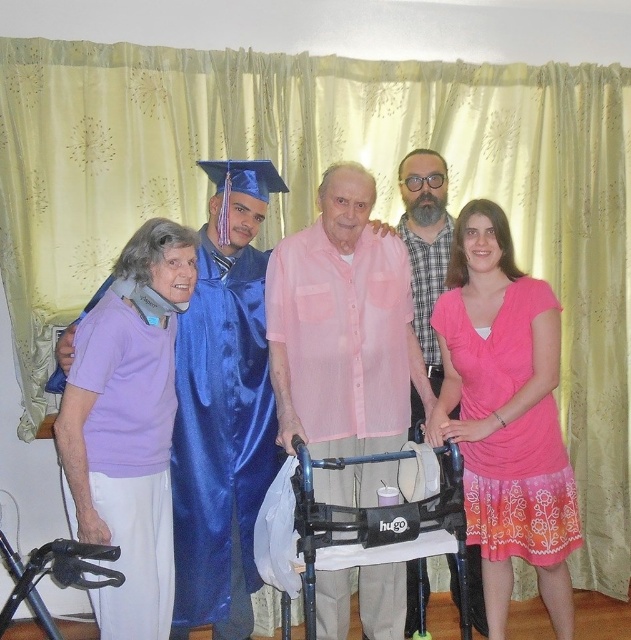
In the scene shown: Can you confirm if pink fabric dress at center is positioned below blue satin graduation gown at center?

Correct, pink fabric dress at center is located below blue satin graduation gown at center.

Can you confirm if pink fabric dress at center is bigger than blue satin graduation gown at center?

Indeed, pink fabric dress at center has a larger size compared to blue satin graduation gown at center.

I want to click on pink fabric dress at center, so 505,413.

Is pink sheer shirt at center smaller than pink satin walker at center?

Correct, pink sheer shirt at center occupies less space than pink satin walker at center.

Identify the location of pink sheer shirt at center. The width and height of the screenshot is (631, 640). (343, 326).

Where is `satin blue graduation gown at center`? This screenshot has height=640, width=631. satin blue graduation gown at center is located at coordinates click(220, 442).

The height and width of the screenshot is (640, 631). Identify the location of satin blue graduation gown at center. (220, 442).

At what (x,y) coordinates should I click in order to perform the action: click on satin blue graduation gown at center. Please return your answer as a coordinate pair (x, y). Looking at the image, I should click on (220, 442).